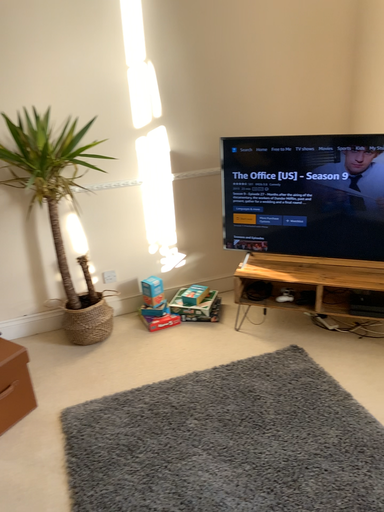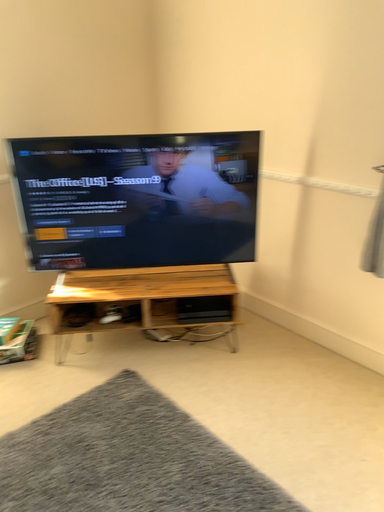
Question: Which way did the camera rotate in the video?

Choices:
 (A) rotated right
 (B) rotated left

Answer: (A)